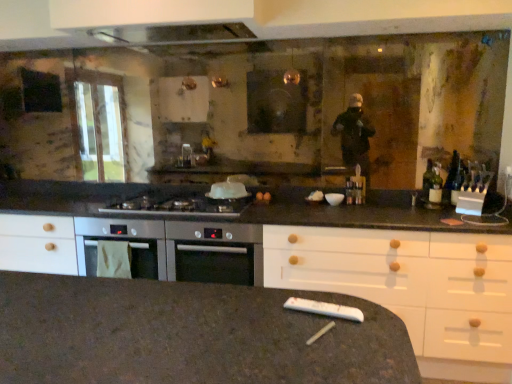
Question: Is satin silver cooktop at center behind white plastic remote control at lower center?

Choices:
 (A) no
 (B) yes

Answer: (B)

Question: Is satin silver cooktop at center oriented away from white plastic remote control at lower center?

Choices:
 (A) yes
 (B) no

Answer: (B)

Question: From a real-world perspective, is satin silver cooktop at center positioned under white plastic remote control at lower center based on gravity?

Choices:
 (A) no
 (B) yes

Answer: (A)

Question: Does satin silver cooktop at center have a lesser width compared to white plastic remote control at lower center?

Choices:
 (A) yes
 (B) no

Answer: (B)

Question: From the image's perspective, does satin silver cooktop at center appear lower than white plastic remote control at lower center?

Choices:
 (A) yes
 (B) no

Answer: (B)

Question: Does satin silver cooktop at center lie in front of white plastic remote control at lower center?

Choices:
 (A) yes
 (B) no

Answer: (B)

Question: From a real-world perspective, is white plastic remote control at lower center on top of satin silver cooktop at center?

Choices:
 (A) no
 (B) yes

Answer: (A)

Question: Is white plastic remote control at lower center touching satin silver cooktop at center?

Choices:
 (A) yes
 (B) no

Answer: (B)

Question: Is white plastic remote control at lower center oriented towards satin silver cooktop at center?

Choices:
 (A) yes
 (B) no

Answer: (B)

Question: Does white plastic remote control at lower center have a lesser height compared to satin silver cooktop at center?

Choices:
 (A) no
 (B) yes

Answer: (B)

Question: From a real-world perspective, is white plastic remote control at lower center located beneath satin silver cooktop at center?

Choices:
 (A) no
 (B) yes

Answer: (B)

Question: Does white plastic remote control at lower center appear on the left side of satin silver cooktop at center?

Choices:
 (A) yes
 (B) no

Answer: (B)

Question: From the image's perspective, relative to satin silver cooktop at center, is white plastic remote control at lower center above or below?

Choices:
 (A) above
 (B) below

Answer: (B)